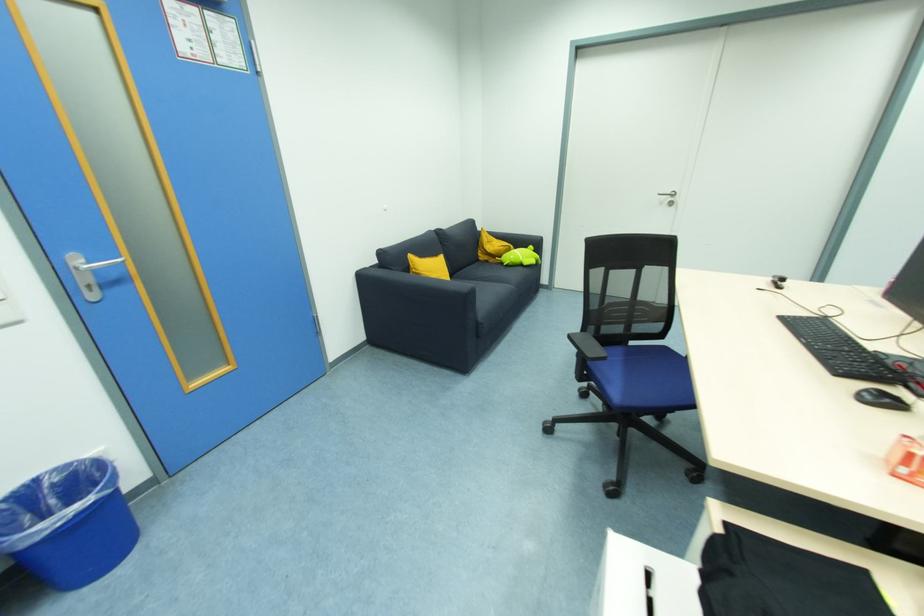
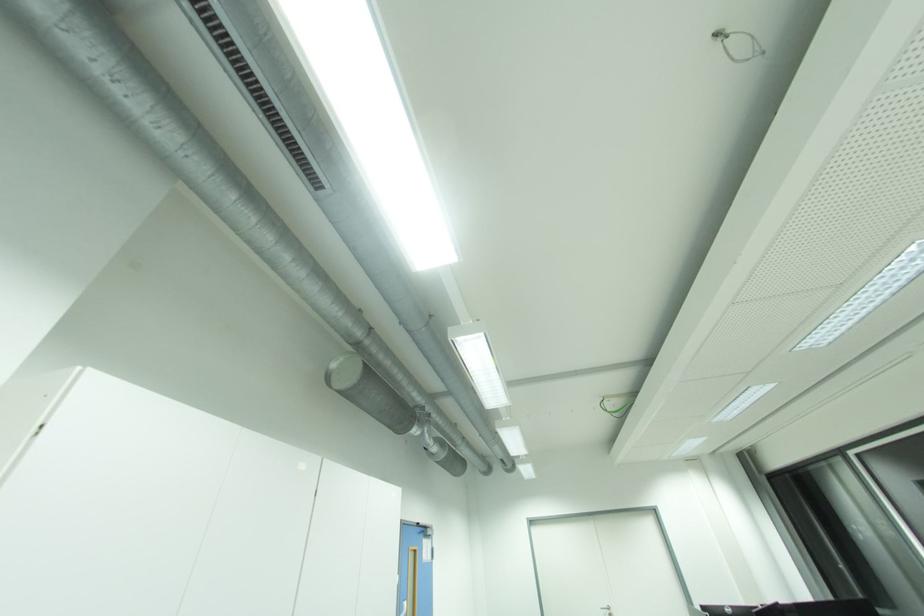
The point at (672, 193) is marked in the first image. Where is the corresponding point in the second image?

(610, 609)